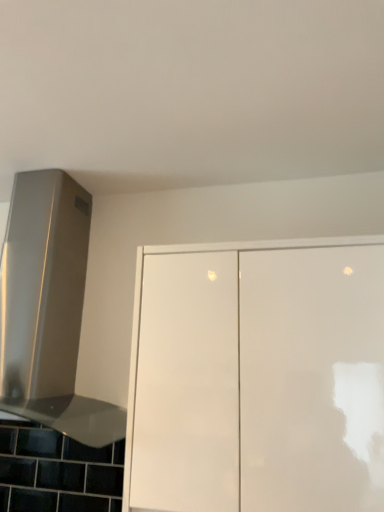
Question: From a real-world perspective, is satin silver vent at upper left positioned under white glossy cabinet at center based on gravity?

Choices:
 (A) no
 (B) yes

Answer: (A)

Question: From a real-world perspective, is satin silver vent at upper left physically above white glossy cabinet at center?

Choices:
 (A) no
 (B) yes

Answer: (B)

Question: Is satin silver vent at upper left not close to white glossy cabinet at center?

Choices:
 (A) yes
 (B) no

Answer: (B)

Question: From the image's perspective, does satin silver vent at upper left appear lower than white glossy cabinet at center?

Choices:
 (A) yes
 (B) no

Answer: (B)

Question: Can you confirm if satin silver vent at upper left is bigger than white glossy cabinet at center?

Choices:
 (A) yes
 (B) no

Answer: (A)

Question: Is satin silver vent at upper left further to the viewer compared to white glossy cabinet at center?

Choices:
 (A) no
 (B) yes

Answer: (B)

Question: Considering the relative positions of white glossy cabinet at center and satin silver vent at upper left in the image provided, is white glossy cabinet at center behind satin silver vent at upper left?

Choices:
 (A) yes
 (B) no

Answer: (B)

Question: Is white glossy cabinet at center in contact with satin silver vent at upper left?

Choices:
 (A) no
 (B) yes

Answer: (A)

Question: Does white glossy cabinet at center lie in front of satin silver vent at upper left?

Choices:
 (A) no
 (B) yes

Answer: (B)

Question: Is white glossy cabinet at center taller than satin silver vent at upper left?

Choices:
 (A) no
 (B) yes

Answer: (A)

Question: From the image's perspective, is white glossy cabinet at center under satin silver vent at upper left?

Choices:
 (A) yes
 (B) no

Answer: (A)

Question: From a real-world perspective, does white glossy cabinet at center stand above satin silver vent at upper left?

Choices:
 (A) yes
 (B) no

Answer: (B)

Question: Is satin silver vent at upper left in front of or behind white glossy cabinet at center in the image?

Choices:
 (A) behind
 (B) front

Answer: (A)